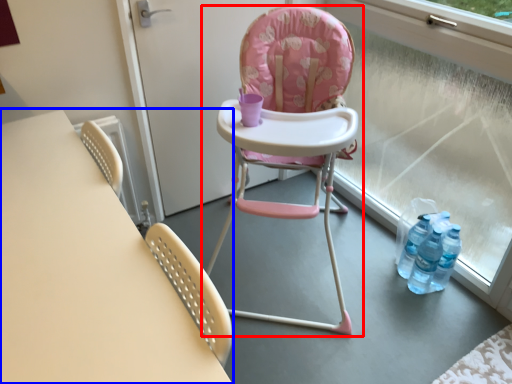
Question: Which object is closer to the camera taking this photo, chair (highlighted by a red box) or table (highlighted by a blue box)?

Choices:
 (A) chair
 (B) table

Answer: (B)